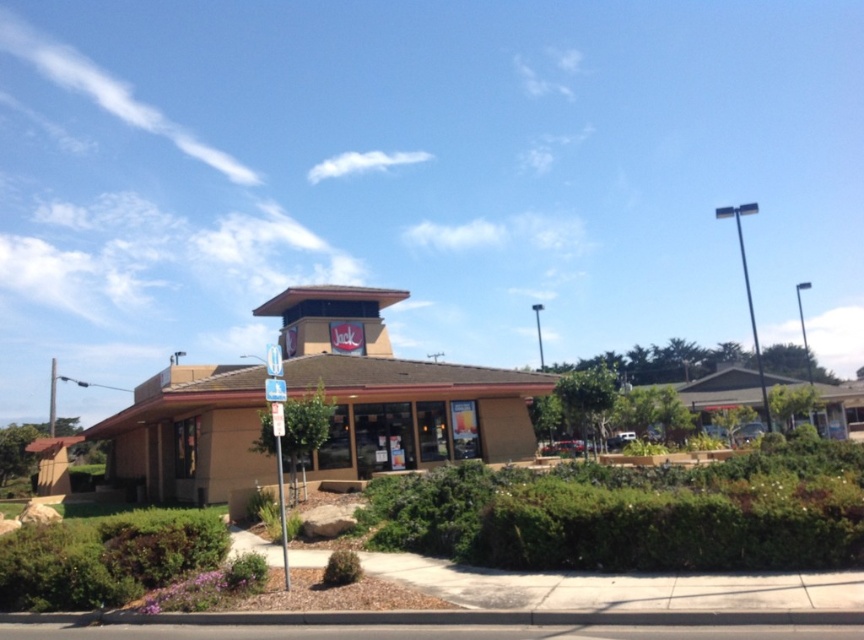
Who is positioned more to the right, green leafy hedge at lower center or tan/beige building at center?

green leafy hedge at lower center is more to the right.

Does point (518, 528) come behind point (331, 365)?

That is False.

Between point (801, 518) and point (437, 445), which one is positioned behind?

The point (437, 445) is more distant.

This screenshot has width=864, height=640. Find the location of `green leafy hedge at lower center`. green leafy hedge at lower center is located at coordinates (634, 513).

Which is above, green leafy hedge at lower center or brown wood building at center?

green leafy hedge at lower center

Identify the location of green leafy hedge at lower center. (634, 513).

Locate an element on the screen. The width and height of the screenshot is (864, 640). green leafy hedge at lower center is located at coordinates (634, 513).

Does green leafy hedge at lower center lie behind green leafy bush at right?

No, green leafy hedge at lower center is closer to the viewer.

Can you confirm if green leafy hedge at lower center is shorter than green leafy bush at right?

Correct, green leafy hedge at lower center is not as tall as green leafy bush at right.

Is point (450, 557) positioned in front of point (785, 410)?

Yes, point (450, 557) is in front of point (785, 410).

I want to click on green leafy hedge at lower center, so click(x=634, y=513).